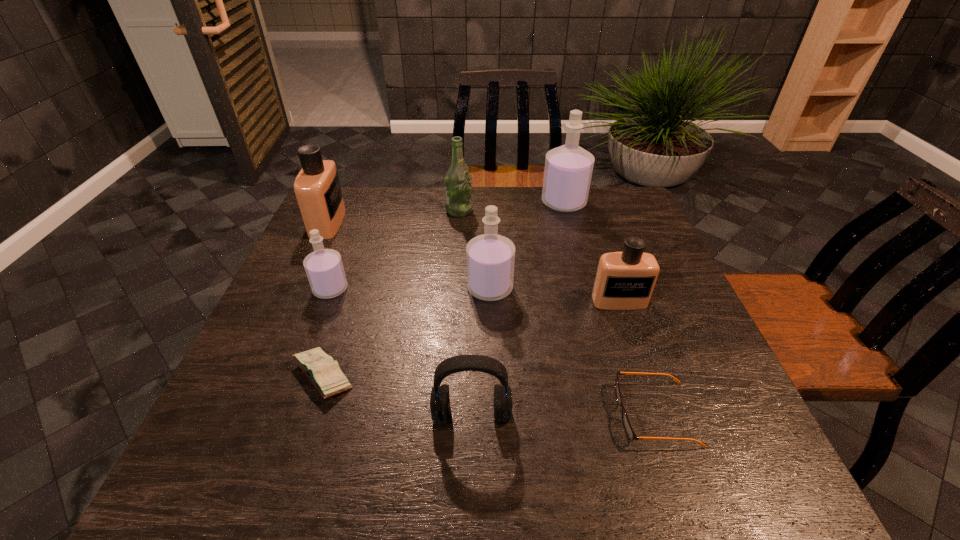
This screenshot has width=960, height=540. What are the coordinates of `object at the near right corner` in the screenshot? It's located at (628, 428).

Locate an element on the screen. vacant region at the far edge of the desktop is located at coordinates (457, 226).

What are the coordinates of `free spot at the near edge of the desktop` in the screenshot? It's located at (666, 494).

You are a GUI agent. You are given a task and a screenshot of the screen. Output one action in this format:
    pyautogui.click(x=<x>, y=<y>)
    Task: Click on the free spot at the left edge of the desktop
    This screenshot has width=960, height=540.
    Given the screenshot: What is the action you would take?
    pyautogui.click(x=319, y=327)

At what (x,y) coordinates should I click in order to perform the action: click on free region at the right edge of the desktop. Please return your answer as a coordinate pair (x, y). Looking at the image, I should click on (656, 388).

In the image, there is a desktop. Where is `free region at the far left corner`? This screenshot has width=960, height=540. free region at the far left corner is located at coordinates (355, 221).

This screenshot has width=960, height=540. In order to click on free space at the far right corner of the desktop in this screenshot , I will do `click(630, 222)`.

Find the location of a particular element. The width and height of the screenshot is (960, 540). vacant space at the near right corner of the desktop is located at coordinates (742, 457).

You are a GUI agent. You are given a task and a screenshot of the screen. Output one action in this format:
    pyautogui.click(x=<x>, y=<y>)
    Task: Click on the vacant point located between the second purple perfume from left to right and the diary
    Image resolution: width=960 pixels, height=540 pixels.
    Given the screenshot: What is the action you would take?
    pyautogui.click(x=406, y=332)

This screenshot has height=540, width=960. What are the coordinates of `free space between the diary and the spectacles` in the screenshot? It's located at (489, 395).